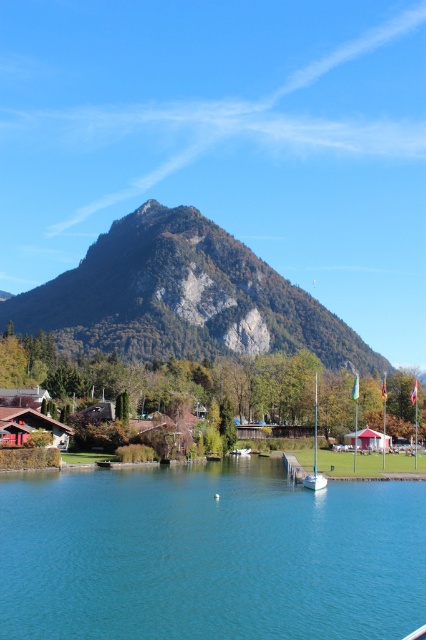
Question: Estimate the real-world distances between objects in this image. Which object is farther from the teal water at center?

Choices:
 (A) rugged stone mountain at center
 (B) white glossy sailboat at center

Answer: (A)

Question: Is teal water at center smaller than white glossy sailboat at center?

Choices:
 (A) no
 (B) yes

Answer: (A)

Question: Estimate the real-world distances between objects in this image. Which object is farther from the rugged stone mountain at center?

Choices:
 (A) white glossy sailboat at center
 (B) teal water at center

Answer: (B)

Question: Does teal water at center have a greater width compared to white glossy sailboat at center?

Choices:
 (A) yes
 (B) no

Answer: (A)

Question: Which of the following is the closest to the observer?

Choices:
 (A) pos(348,602)
 (B) pos(316,378)

Answer: (A)

Question: Can you confirm if teal water at center is positioned to the left of white glossy sailboat at center?

Choices:
 (A) yes
 (B) no

Answer: (A)